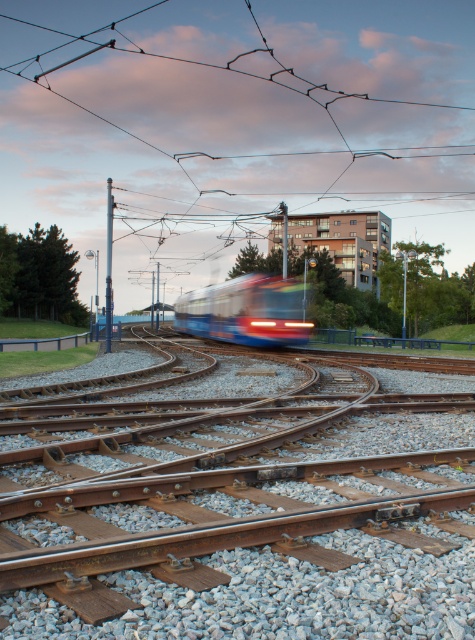
Is brown wooden track at center smaller than blue glossy tram at center?

Yes, brown wooden track at center is smaller than blue glossy tram at center.

How much distance is there between brown wooden track at center and blue glossy tram at center?

brown wooden track at center is 18.86 meters away from blue glossy tram at center.

Which is in front, point (438, 500) or point (257, 284)?

Point (438, 500) is more forward.

Image resolution: width=475 pixels, height=640 pixels. I want to click on brown wooden track at center, so click(x=245, y=522).